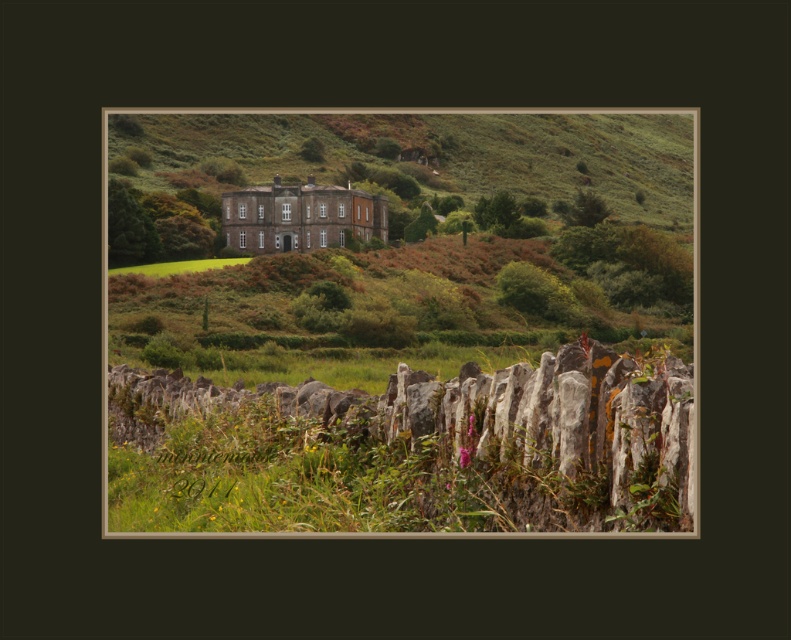
You are a gardener planning to mow the green grass at center. However, there is a gray stone fence at lower center in the way. Can you mow the grass without moving the fence?

The gray stone fence at lower center is wider than the green grass at center, so the fence may block access to the grass. You might need to move the fence or use a smaller mower to navigate around it.

You are a gardener who wants to plant a new flower bed between the gray stone fence at lower center and the green grass at center. Considering their heights, which object should you place the flowers closer to?

The gray stone fence at lower center is taller than the green grass at center, so you should place the flowers closer to the green grass at center to ensure they receive enough sunlight.